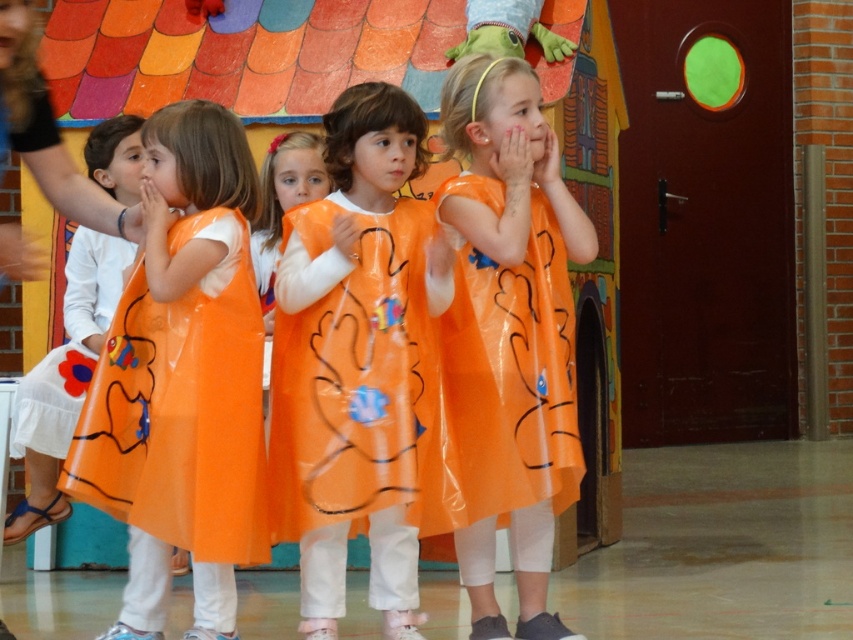
Question: Can you confirm if transparent orange dress at center is thinner than orange translucent dress at center?

Choices:
 (A) yes
 (B) no

Answer: (A)

Question: Among these objects, which one is farthest from the camera?

Choices:
 (A) orange plastic dress at center
 (B) transparent orange dress at center

Answer: (A)

Question: Does transparent orange dress at center have a larger size compared to orange translucent dress at center?

Choices:
 (A) no
 (B) yes

Answer: (B)

Question: Which point is farther from the camera taking this photo?

Choices:
 (A) (202, 381)
 (B) (543, 372)

Answer: (B)

Question: Where is transparent orange dress at center located in relation to orange translucent dress at center in the image?

Choices:
 (A) right
 (B) left

Answer: (A)

Question: Which point is farther to the camera?

Choices:
 (A) (285, 365)
 (B) (450, 307)

Answer: (B)